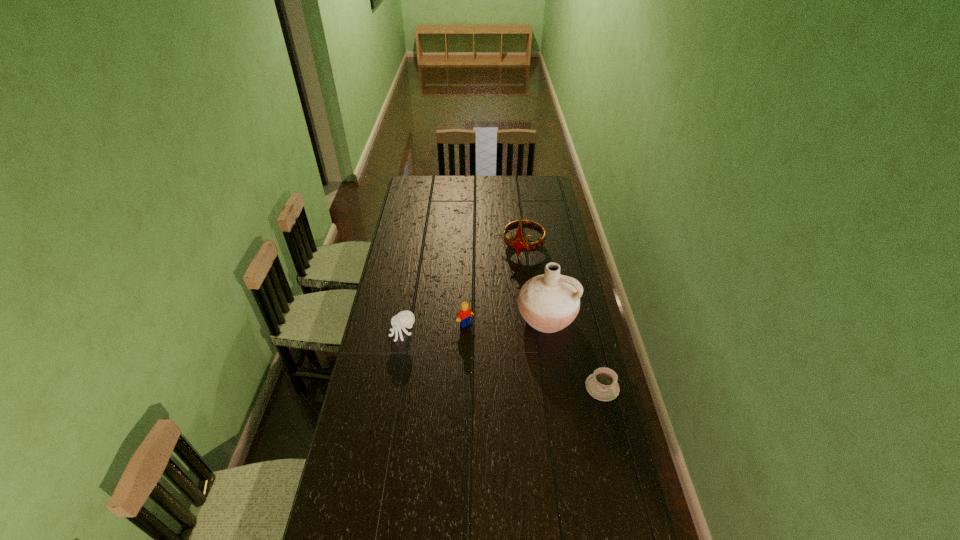
At what (x,y) coordinates should I click in order to perform the action: click on blank area located 0.090m on the handle side of the nearest object. Please return your answer as a coordinate pair (x, y). Looking at the image, I should click on (562, 387).

Where is `vacant area situated on the face of the Lego`? The image size is (960, 540). vacant area situated on the face of the Lego is located at coordinates (478, 337).

Locate an element on the screen. This screenshot has width=960, height=540. vacant region located on the face of the Lego is located at coordinates (504, 367).

Image resolution: width=960 pixels, height=540 pixels. I want to click on vacant area situated 0.350m on the face of the Lego, so click(521, 386).

Identify the location of blank space located 0.090m on the front-facing side of the tiara. (513, 271).

The width and height of the screenshot is (960, 540). I want to click on blank area located on the front-facing side of the tiara, so click(x=501, y=296).

I want to click on vacant space located on the front-facing side of the tiara, so click(512, 273).

Where is `free space located 0.050m to pour from the handle of the pottery`? This screenshot has height=540, width=960. free space located 0.050m to pour from the handle of the pottery is located at coordinates (530, 347).

Find the location of a particular element. This screenshot has width=960, height=540. vacant space located to pour from the handle of the pottery is located at coordinates (528, 350).

At what (x,y) coordinates should I click in order to perform the action: click on free space located to pour from the handle of the pottery. Please return your answer as a coordinate pair (x, y). Looking at the image, I should click on (495, 409).